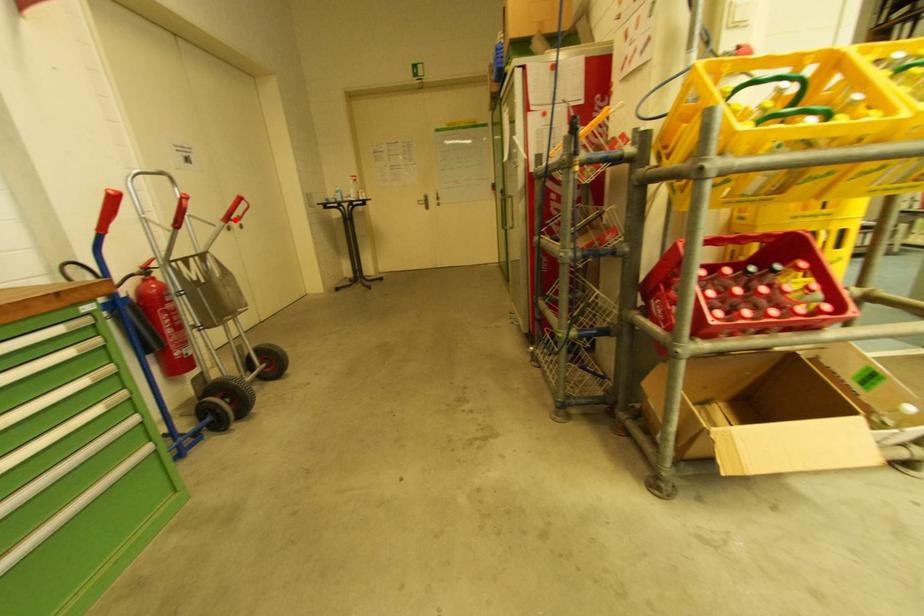
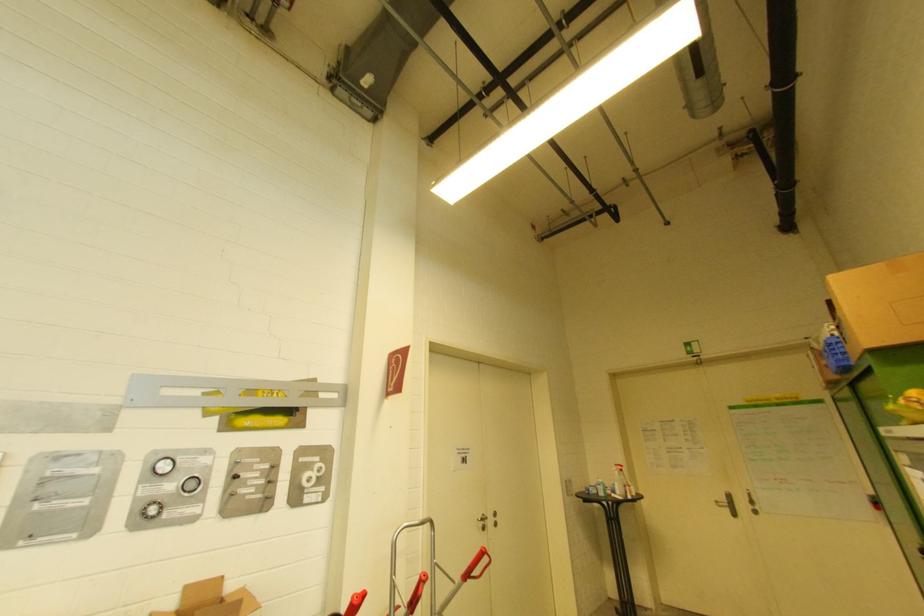
Question: I am providing you with two images of the same scene from different viewpoints. A red point is shown in image1. For the corresponding object point in image2, is it positioned nearer or farther from the camera?

Choices:
 (A) Nearer
 (B) Farther

Answer: (B)